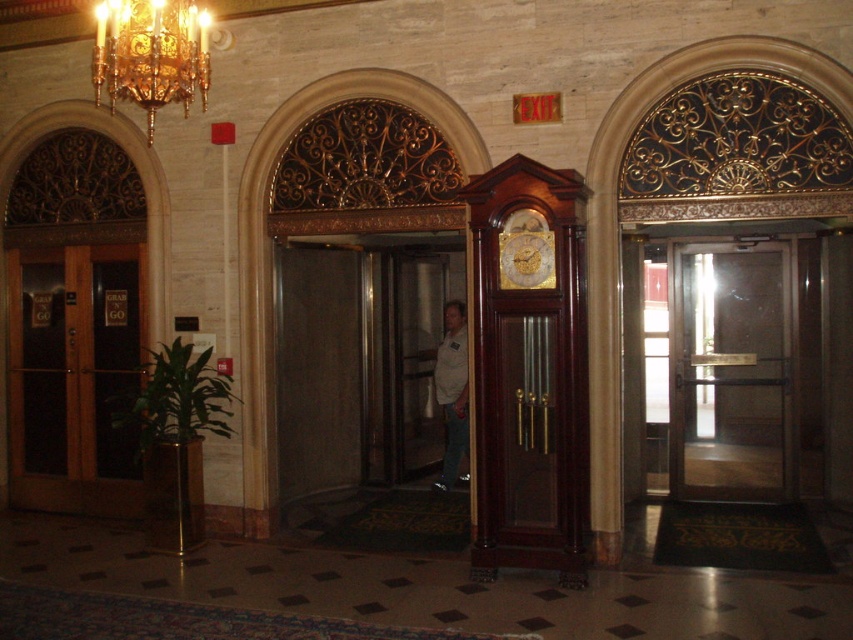
Question: Which point is farther to the camera?

Choices:
 (A) (70, 321)
 (B) (456, 300)
 (C) (724, 365)

Answer: (B)

Question: Does transparent glass door at right appear over gold crystal chandelier at upper left?

Choices:
 (A) no
 (B) yes

Answer: (A)

Question: Is mahogany wood grandfather clock at center smaller than light brown leather jacket at center?

Choices:
 (A) yes
 (B) no

Answer: (B)

Question: Considering the real-world distances, which object is closest to the gold crystal chandelier at upper left?

Choices:
 (A) gold-toned wood grandfather clock at center
 (B) mahogany wood grandfather clock at center
 (C) brown wooden door at left
 (D) transparent glass door at right

Answer: (A)

Question: Which point is farther from the camera taking this photo?

Choices:
 (A) (172, 74)
 (B) (463, 452)
 (C) (549, 259)
 (D) (515, 163)

Answer: (B)

Question: Is brown wooden door at left to the left of transparent glass door at right from the viewer's perspective?

Choices:
 (A) yes
 (B) no

Answer: (A)